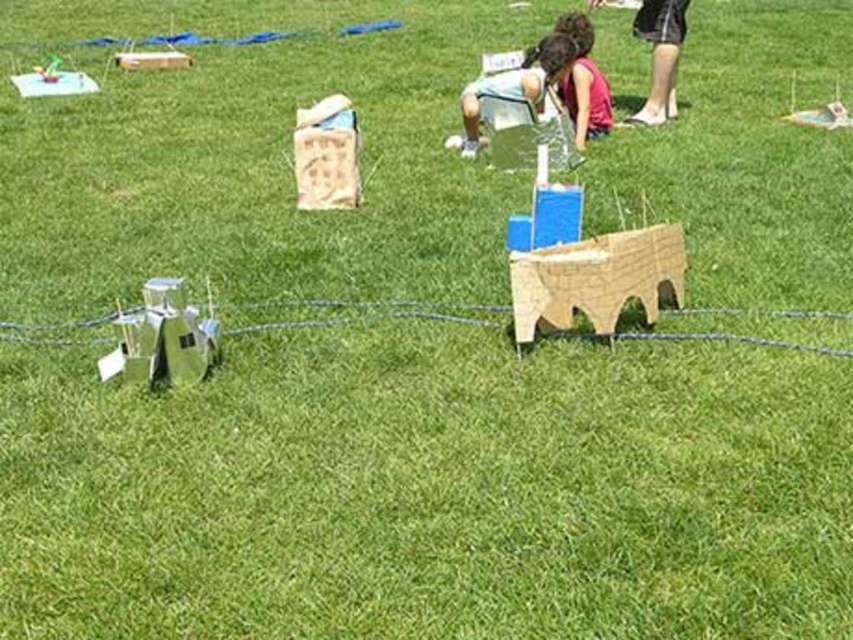
Question: Is green cardboard string at lower left further to camera compared to light brown cardboard at center?

Choices:
 (A) yes
 (B) no

Answer: (B)

Question: Which object appears farthest from the camera in this image?

Choices:
 (A) black fabric shorts at upper right
 (B) green cardboard string at lower left
 (C) red shirt at center
 (D) light brown cardboard at center

Answer: (A)

Question: Which object appears farthest from the camera in this image?

Choices:
 (A) light brown cardboard at center
 (B) red shirt at center
 (C) black fabric shorts at upper right

Answer: (C)

Question: Among these points, which one is farthest from the camera?

Choices:
 (A) (106, 314)
 (B) (595, 116)

Answer: (B)

Question: Does green cardboard string at lower left have a greater width compared to red shirt at center?

Choices:
 (A) yes
 (B) no

Answer: (A)

Question: Does light brown cardboard at center come in front of red shirt at center?

Choices:
 (A) no
 (B) yes

Answer: (B)